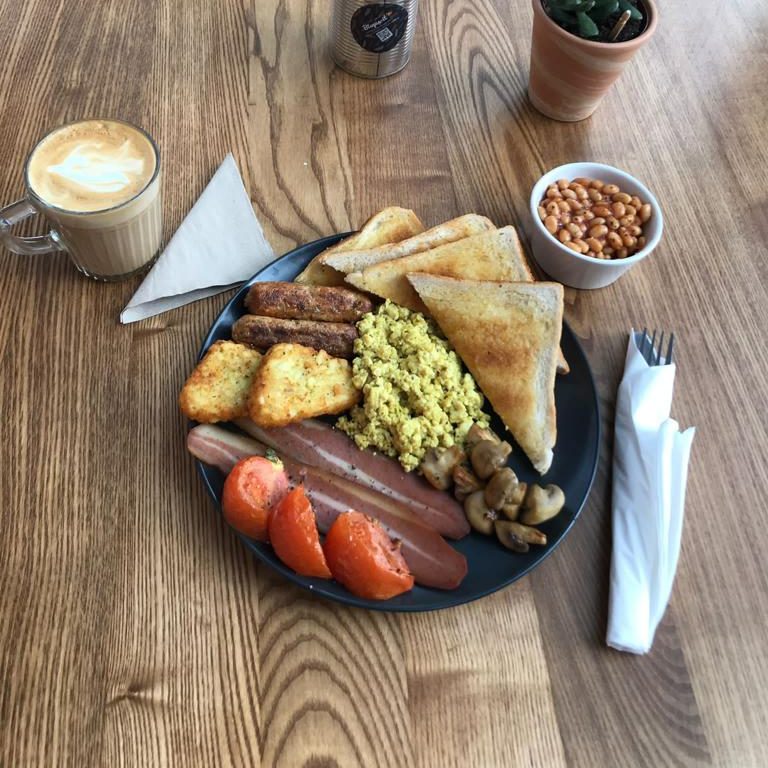
Where is `roll of silverware`? roll of silverware is located at coordinates (644, 492).